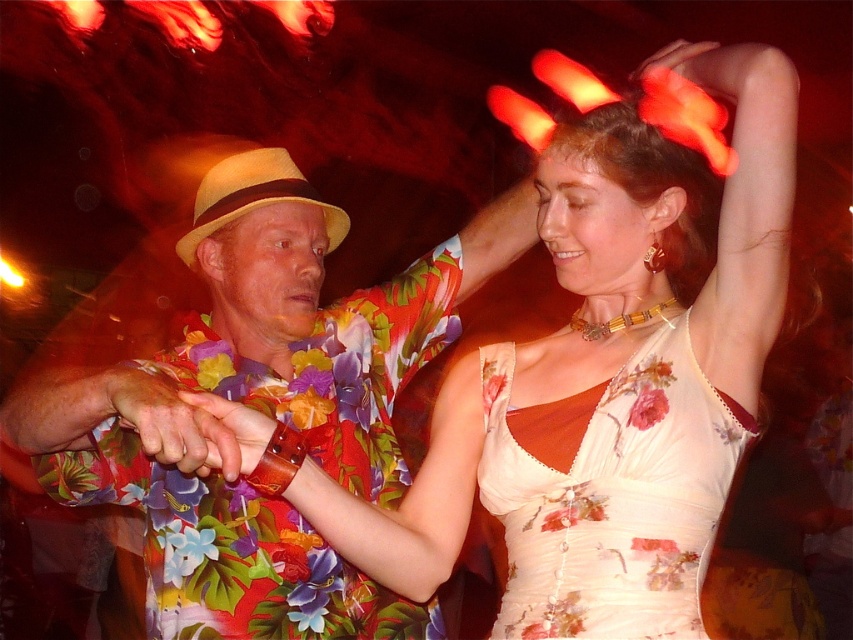
You are at the center of the image and want to move towards the white floral dress at center. Which direction should you move to reach it?

Since the white floral dress at center is located at point (606, 371), you should move towards the lower right direction to reach it.

You are planning to hang both the floral silk dress at center and the beige straw cowboy hat at center on a single hanger. The hanger has a maximum width capacity of 40 cm. According to the description, can both items fit on the hanger together?

The floral silk dress at center might be wider than beige straw cowboy hat at center. Since the total width of both items combined could exceed the hanger capacity, it is uncertain if they will fit together. Check their individual widths before deciding.

You are a photographer at a party and want to take a photo of the two items at the center of the image. The floral silk dress at center and the beige straw cowboy hat at center. The minimum distance your camera can focus on two objects is 30 inches. Will both items be in focus?

The floral silk dress at center and the beige straw cowboy hat at center are 30.65 inches apart. Since the minimum focus distance is 30 inches, the camera can focus on both items as the distance between them is slightly over the required minimum.